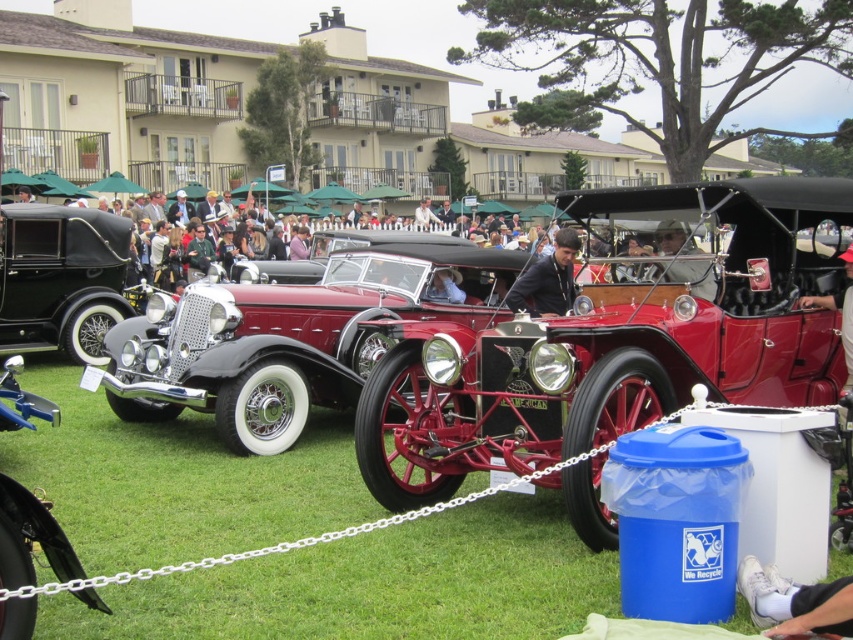
Question: Is shiny chrome car at center below white fabric shoe at lower right?

Choices:
 (A) no
 (B) yes

Answer: (A)

Question: Can you confirm if white fabric shoe at lower right is positioned below dark blue leather jacket at center?

Choices:
 (A) yes
 (B) no

Answer: (A)

Question: Which object is farther from the camera taking this photo?

Choices:
 (A) shiny chrome car at center
 (B) shiny red car at center
 (C) white fabric shoe at lower right
 (D) matte black car at center

Answer: (A)

Question: Which point is farther to the camera?

Choices:
 (A) (705, 288)
 (B) (384, 349)
 (C) (114, 232)
 (D) (535, 291)

Answer: (C)

Question: Is shiny red car at center positioned behind matte black car at center?

Choices:
 (A) yes
 (B) no

Answer: (B)

Question: Among these objects, which one is farthest from the camera?

Choices:
 (A) white fabric shoe at lower right
 (B) shiny red car at center
 (C) matte black car at center

Answer: (C)